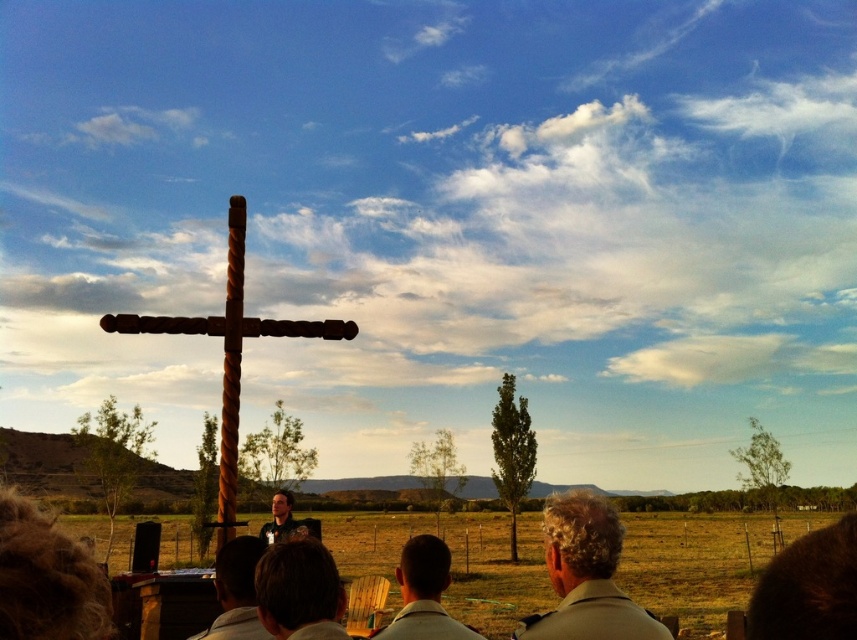
Question: Which object appears farthest from the camera in this image?

Choices:
 (A) light brown wooden chair at lower center
 (B) smooth brown hair at center
 (C) light beige shirt at center
 (D) twisted wood cross at center

Answer: (D)

Question: Which of the following is the farthest from the observer?

Choices:
 (A) dark brown hair at lower center
 (B) twisted wood cross at center

Answer: (B)

Question: Which of the following is the farthest from the observer?

Choices:
 (A) (448, 572)
 (B) (562, 564)
 (C) (219, 627)

Answer: (C)

Question: Is smooth brown hair at center smaller than light brown wooden chair at lower center?

Choices:
 (A) no
 (B) yes

Answer: (A)

Question: Does light beige shirt at center have a larger size compared to light brown wooden chair at lower center?

Choices:
 (A) yes
 (B) no

Answer: (A)

Question: Does dark brown hair at lower center have a larger size compared to light brown wooden chair at lower center?

Choices:
 (A) no
 (B) yes

Answer: (A)